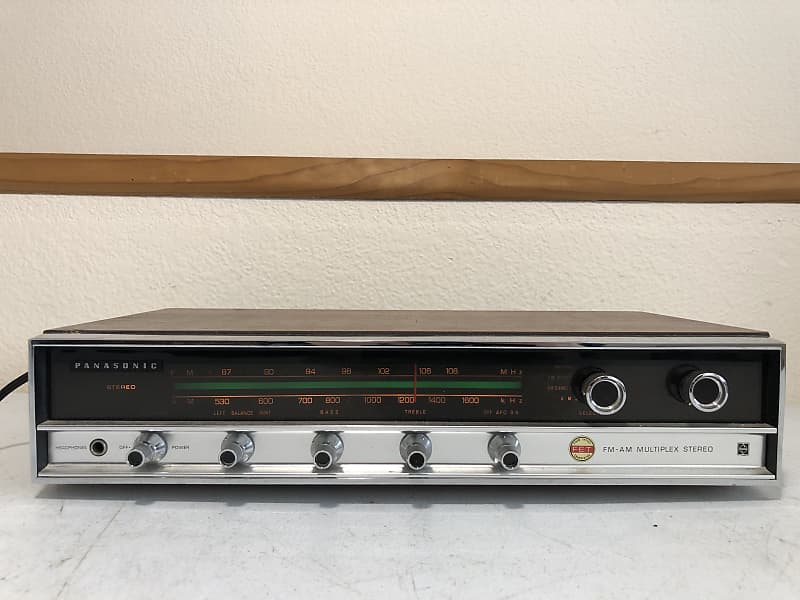
The image size is (800, 600). I want to click on wall, so click(x=293, y=264).